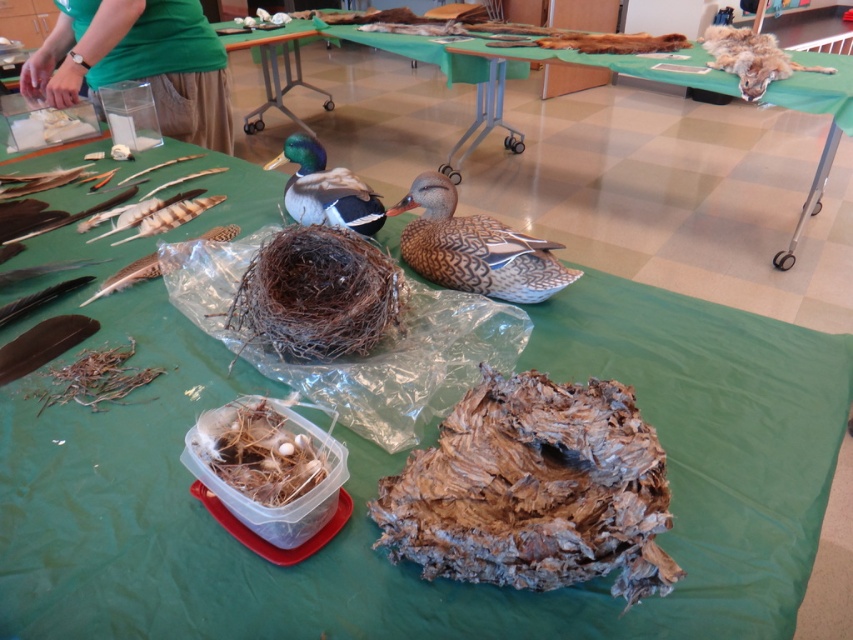
Between brown woven nest at center and green plastic table at center, which one has more height?

green plastic table at center

Between brown woven nest at center and green plastic table at center, which one has less height?

brown woven nest at center

Who is more distant from viewer, (282, 264) or (328, 104)?

The point (328, 104) is more distant.

The image size is (853, 640). I want to click on brown woven nest at center, so click(x=317, y=294).

Is the position of green fabric shirt at upper left less distant than that of fuzzy brown fur at upper right?

Yes.

Is point (94, 42) positioned in front of point (772, 76)?

Yes, it is in front of point (772, 76).

Find the location of a particular element. The width and height of the screenshot is (853, 640). green fabric shirt at upper left is located at coordinates (138, 61).

How distant is shiny green duck at center from green plastic table at center?

A distance of 3.27 meters exists between shiny green duck at center and green plastic table at center.

Does shiny green duck at center have a greater height compared to green plastic table at center?

In fact, shiny green duck at center may be shorter than green plastic table at center.

In the scene shown: Who is more distant from viewer, (x=332, y=225) or (x=225, y=45)?

The point (x=225, y=45) is more distant.

Locate an element on the screen. shiny green duck at center is located at coordinates (326, 189).